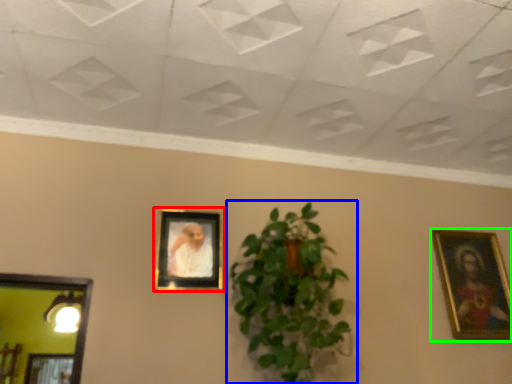
Question: Which object is the closest to the picture frame (highlighted by a red box)? Choose among these: houseplant (highlighted by a blue box) or picture frame (highlighted by a green box).

Choices:
 (A) houseplant
 (B) picture frame

Answer: (A)